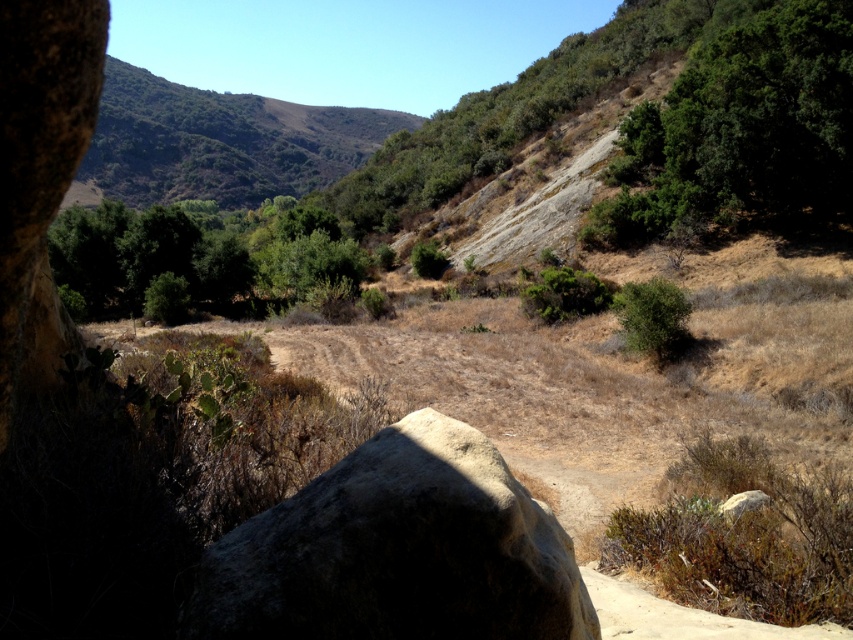
You are a hiker trying to navigate through the dry terrain. You see the dark gray rough boulder at center and the green leafy tree at center. Which object takes up more space in the scene?

The green leafy tree at center occupies more space than the dark gray rough boulder at center.